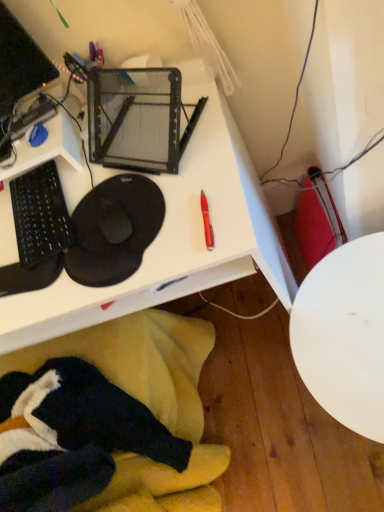
Question: Does black matte mouse pad at left appear on the left side of white glossy table at lower right?

Choices:
 (A) no
 (B) yes

Answer: (B)

Question: From a real-world perspective, is black matte mouse pad at left under white glossy table at lower right?

Choices:
 (A) no
 (B) yes

Answer: (A)

Question: Is black matte mouse pad at left bigger than white glossy table at lower right?

Choices:
 (A) yes
 (B) no

Answer: (B)

Question: Could you tell me if black matte mouse pad at left is facing white glossy table at lower right?

Choices:
 (A) no
 (B) yes

Answer: (A)

Question: Is white glossy table at lower right a part of black matte mouse pad at left?

Choices:
 (A) yes
 (B) no

Answer: (B)

Question: From the image's perspective, is black matte mouse pad at left located above or below velvet-like black swivel chair at lower left?

Choices:
 (A) below
 (B) above

Answer: (B)

Question: Visually, is black matte mouse pad at left positioned to the left or to the right of velvet-like black swivel chair at lower left?

Choices:
 (A) left
 (B) right

Answer: (B)

Question: Would you say black matte mouse pad at left is inside or outside velvet-like black swivel chair at lower left?

Choices:
 (A) outside
 (B) inside

Answer: (A)

Question: Is point click(87, 238) positioned closer to the camera than point click(190, 342)?

Choices:
 (A) farther
 (B) closer

Answer: (B)

Question: Does point (79, 268) appear closer or farther from the camera than point (352, 332)?

Choices:
 (A) closer
 (B) farther

Answer: (A)

Question: Do you think black matte mouse pad at left is within white glossy table at lower right, or outside of it?

Choices:
 (A) outside
 (B) inside

Answer: (A)

Question: From the image's perspective, is black matte mouse pad at left above or below white glossy table at lower right?

Choices:
 (A) below
 (B) above

Answer: (B)

Question: From a real-world perspective, relative to white glossy table at lower right, is black matte mouse pad at left vertically above or below?

Choices:
 (A) below
 (B) above

Answer: (B)

Question: Is white glossy table at lower right bigger or smaller than white plastic desk at upper center?

Choices:
 (A) small
 (B) big

Answer: (A)

Question: From a real-world perspective, relative to white plastic desk at upper center, is white glossy table at lower right vertically above or below?

Choices:
 (A) above
 (B) below

Answer: (B)